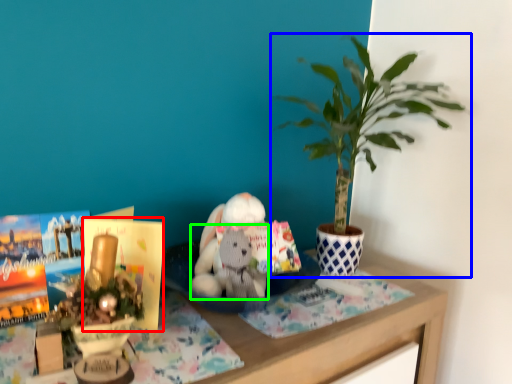
Question: Estimate the real-world distances between objects in this image. Which object is farther from paperback book (highlighted by a red box), houseplant (highlighted by a blue box) or animal (highlighted by a green box)?

Choices:
 (A) houseplant
 (B) animal

Answer: (A)